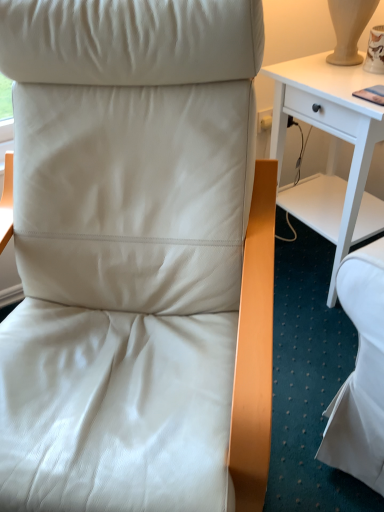
Question: Is matte white leather chair at center in front of white wood desk at center?

Choices:
 (A) yes
 (B) no

Answer: (A)

Question: Would you say matte white leather chair at center is outside white wood desk at center?

Choices:
 (A) yes
 (B) no

Answer: (A)

Question: Considering the relative positions of matte white leather chair at center and white wood desk at center in the image provided, is matte white leather chair at center behind white wood desk at center?

Choices:
 (A) yes
 (B) no

Answer: (B)

Question: Can you confirm if matte white leather chair at center is positioned to the right of white wood desk at center?

Choices:
 (A) yes
 (B) no

Answer: (B)

Question: From the image's perspective, is matte white leather chair at center located above white wood desk at center?

Choices:
 (A) yes
 (B) no

Answer: (B)

Question: From the image's perspective, does matte white leather chair at center appear lower than white wood desk at center?

Choices:
 (A) yes
 (B) no

Answer: (A)

Question: From a real-world perspective, is white wood desk at center below matte white leather chair at center?

Choices:
 (A) no
 (B) yes

Answer: (B)

Question: Can you confirm if white wood desk at center is taller than matte white leather chair at center?

Choices:
 (A) yes
 (B) no

Answer: (B)

Question: Is white wood desk at center oriented away from matte white leather chair at center?

Choices:
 (A) yes
 (B) no

Answer: (B)

Question: Is white wood desk at center thinner than matte white leather chair at center?

Choices:
 (A) no
 (B) yes

Answer: (B)

Question: Is white wood desk at center positioned far away from matte white leather chair at center?

Choices:
 (A) yes
 (B) no

Answer: (B)

Question: Is white wood desk at center with matte white leather chair at center?

Choices:
 (A) yes
 (B) no

Answer: (B)

Question: In terms of height, does matte white leather chair at center look taller or shorter compared to white wood desk at center?

Choices:
 (A) short
 (B) tall

Answer: (B)